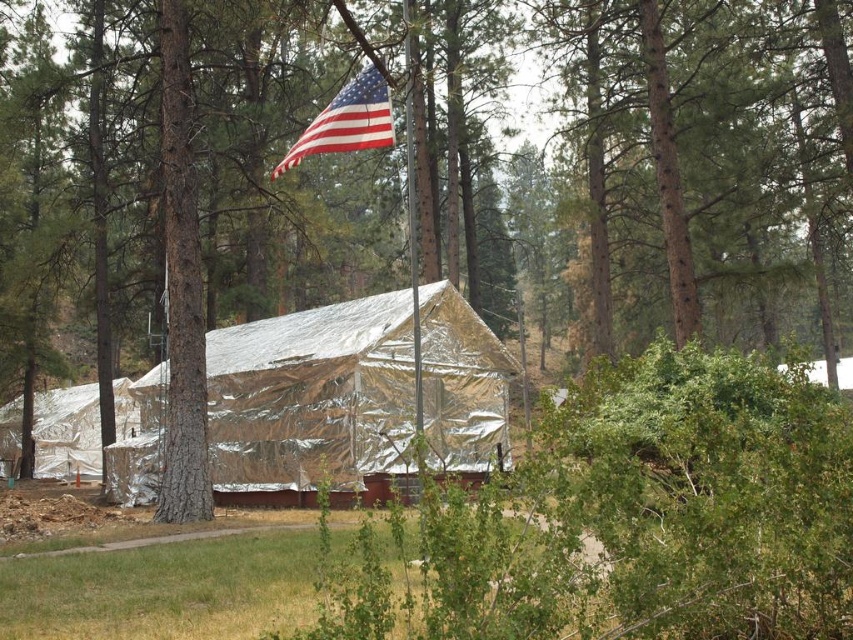
Which is behind, point (248, 326) or point (381, 102)?

The point (248, 326) is more distant.

Identify the location of gold reflective tarp at center. This screenshot has height=640, width=853. (312, 396).

Is gold reflective tarp at center above silver reflective tarp at lower left?

Correct, gold reflective tarp at center is located above silver reflective tarp at lower left.

Is gold reflective tarp at center thinner than silver reflective tarp at lower left?

No.

At what (x,y) coordinates should I click in order to perform the action: click on gold reflective tarp at center. Please return your answer as a coordinate pair (x, y). Image resolution: width=853 pixels, height=640 pixels. Looking at the image, I should click on (312, 396).

Find the location of `gold reflective tarp at center`. gold reflective tarp at center is located at coordinates (312, 396).

Is silver reflective tarp at lower left thinner than american flag at upper center?

No.

Does point (73, 392) come in front of point (372, 116)?

No, it is behind (372, 116).

At what (x,y) coordinates should I click in order to perform the action: click on silver reflective tarp at lower left. Please return your answer as a coordinate pair (x, y). This screenshot has height=640, width=853. Looking at the image, I should click on (67, 433).